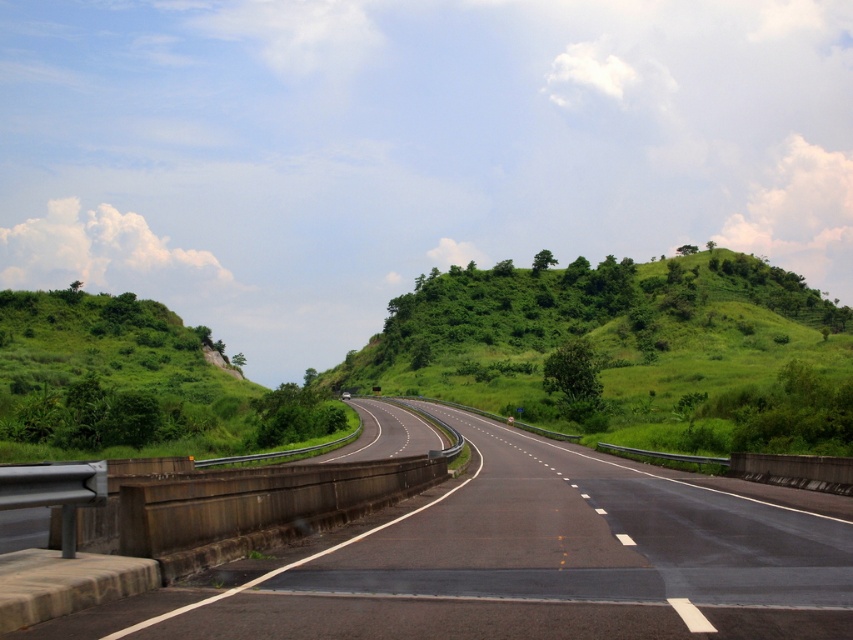
Find the location of a particular element. black asphalt highway at center is located at coordinates (527, 560).

Is point (833, 618) closer to viewer compared to point (747, 403)?

Yes, point (833, 618) is in front of point (747, 403).

Is point (814, 525) behind point (645, 305)?

No, it is not.

I want to click on black asphalt highway at center, so click(x=527, y=560).